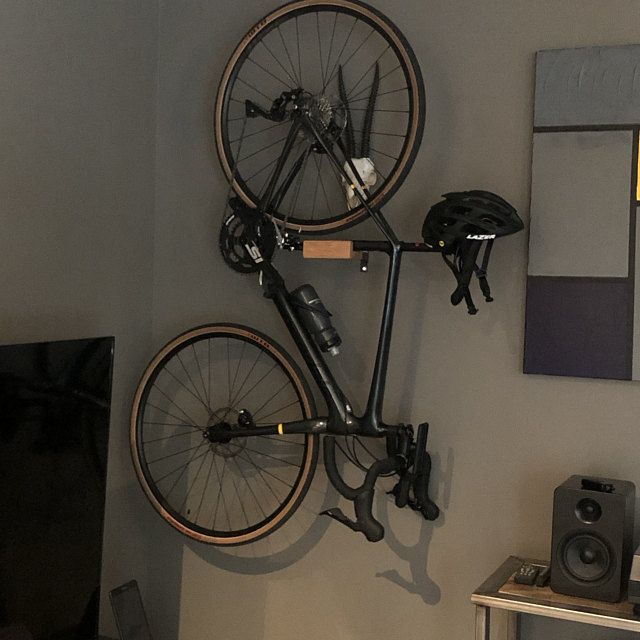
Image resolution: width=640 pixels, height=640 pixels. What are the coordinates of `remote` in the screenshot? It's located at (530, 580).